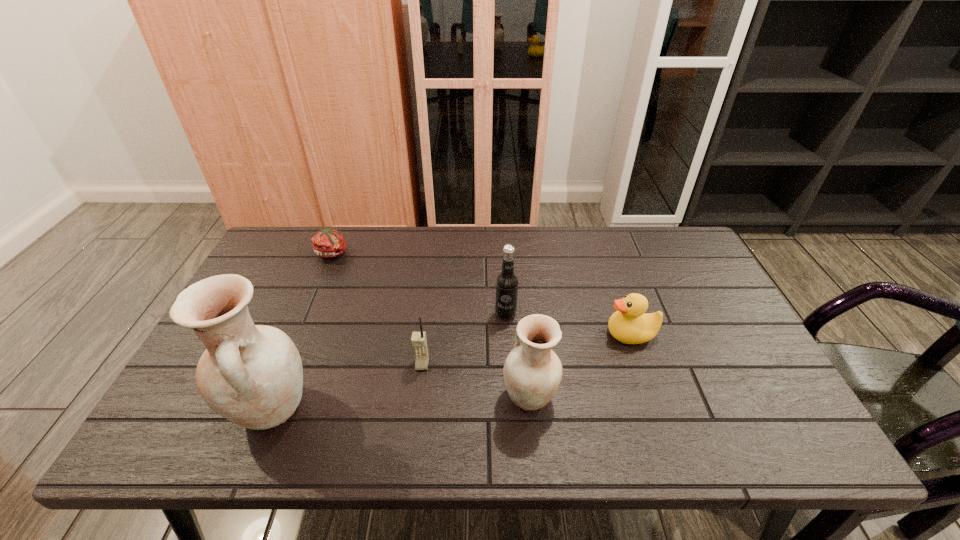
In order to click on vacant area between the rightmost object and the shorter pottery in this screenshot , I will do `click(581, 365)`.

The image size is (960, 540). I want to click on free space between the shorter pottery and the left pottery, so click(400, 403).

This screenshot has height=540, width=960. What are the coordinates of `free space between the cellular telephone and the shorter pottery` in the screenshot? It's located at (476, 381).

You are a GUI agent. You are given a task and a screenshot of the screen. Output one action in this format:
    pyautogui.click(x=<x>, y=<y>)
    Task: Click on the vacant area that lies between the tomato and the right pottery
    The width and height of the screenshot is (960, 540).
    Given the screenshot: What is the action you would take?
    pyautogui.click(x=431, y=325)

I want to click on free space between the fourth farthest object and the farthest object, so click(377, 309).

Identify the location of free space between the root beer and the taller pottery. (388, 362).

Locate an element on the screen. This screenshot has height=540, width=960. vacant area between the root beer and the left pottery is located at coordinates (388, 362).

Identify which object is located as the second nearest to the root beer. Please provide its 2D coordinates. Your answer should be formatted as a tuple, i.e. [(x, y)], where the tuple contains the x and y coordinates of a point satisfying the conditions above.

[(419, 342)]

Identify which object is located as the second nearest to the taller pottery. Please provide its 2D coordinates. Your answer should be formatted as a tuple, i.e. [(x, y)], where the tuple contains the x and y coordinates of a point satisfying the conditions above.

[(327, 243)]